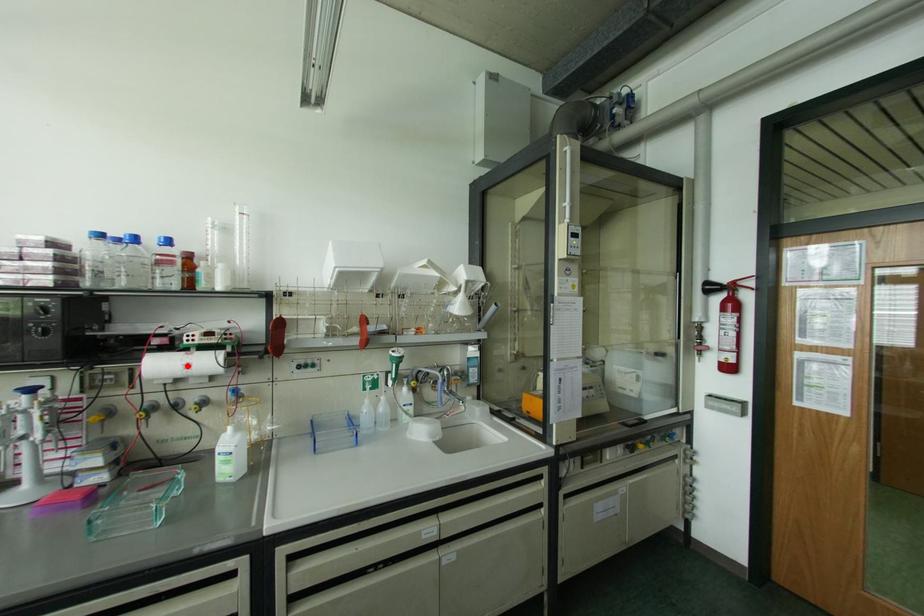
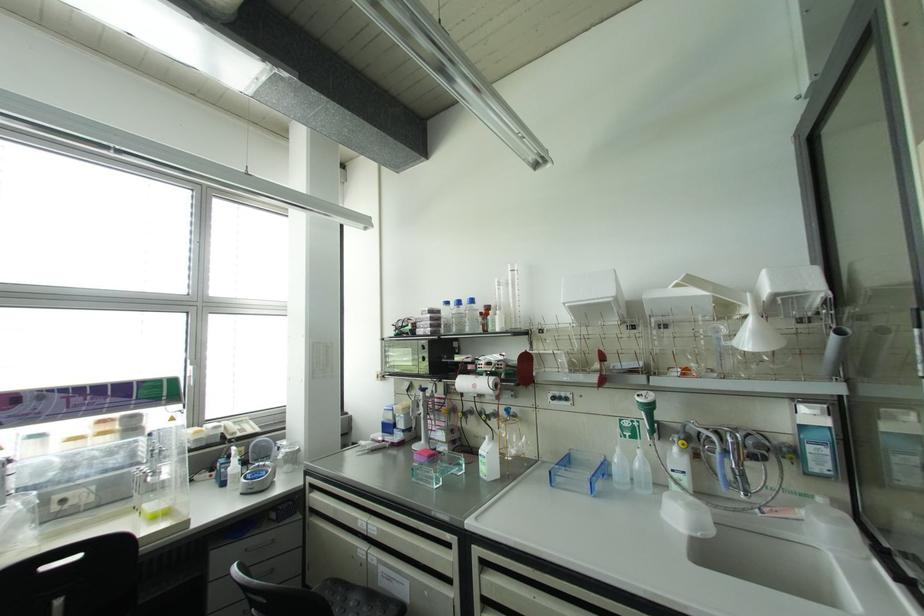
In the second image, find the point that corresponds to the highlighted location in the first image.

(473, 386)